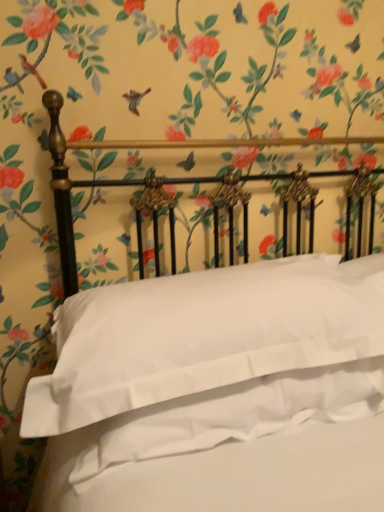
Question: Is white smooth pillow at center inside or outside of white satin sheet at center?

Choices:
 (A) inside
 (B) outside

Answer: (B)

Question: From a real-world perspective, is white smooth pillow at center above or below white satin sheet at center?

Choices:
 (A) below
 (B) above

Answer: (B)

Question: In terms of width, does white smooth pillow at center look wider or thinner when compared to white satin sheet at center?

Choices:
 (A) wide
 (B) thin

Answer: (A)

Question: Is white satin sheet at center bigger or smaller than white smooth pillow at center?

Choices:
 (A) small
 (B) big

Answer: (A)

Question: Considering the positions of white satin sheet at center and white smooth pillow at center in the image, is white satin sheet at center taller or shorter than white smooth pillow at center?

Choices:
 (A) short
 (B) tall

Answer: (A)

Question: Relative to white smooth pillow at center, is white satin sheet at center in front or behind?

Choices:
 (A) behind
 (B) front

Answer: (A)

Question: From a real-world perspective, is white satin sheet at center above or below white smooth pillow at center?

Choices:
 (A) below
 (B) above

Answer: (A)